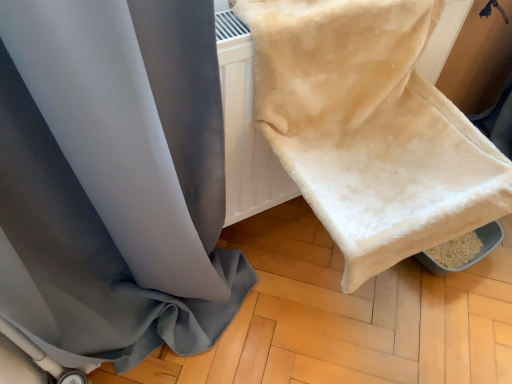
Question: Does beige plush towel at upper right have a greater height compared to satin gray curtain at upper left?

Choices:
 (A) no
 (B) yes

Answer: (A)

Question: From a real-world perspective, is beige plush towel at upper right beneath satin gray curtain at upper left?

Choices:
 (A) no
 (B) yes

Answer: (A)

Question: Is satin gray curtain at upper left at the back of beige plush towel at upper right?

Choices:
 (A) no
 (B) yes

Answer: (A)

Question: Considering the relative positions of beige plush towel at upper right and satin gray curtain at upper left in the image provided, is beige plush towel at upper right behind satin gray curtain at upper left?

Choices:
 (A) no
 (B) yes

Answer: (B)

Question: From a real-world perspective, is beige plush towel at upper right over satin gray curtain at upper left?

Choices:
 (A) no
 (B) yes

Answer: (B)

Question: Does beige plush towel at upper right come in front of satin gray curtain at upper left?

Choices:
 (A) yes
 (B) no

Answer: (B)

Question: From a real-world perspective, is satin gray curtain at upper left positioned over beige plush towel at upper right based on gravity?

Choices:
 (A) yes
 (B) no

Answer: (B)

Question: From the image's perspective, is satin gray curtain at upper left located beneath beige plush towel at upper right?

Choices:
 (A) yes
 (B) no

Answer: (A)

Question: From a real-world perspective, is satin gray curtain at upper left below beige plush towel at upper right?

Choices:
 (A) yes
 (B) no

Answer: (A)

Question: Considering the relative positions of satin gray curtain at upper left and beige plush towel at upper right in the image provided, is satin gray curtain at upper left to the left of beige plush towel at upper right from the viewer's perspective?

Choices:
 (A) yes
 (B) no

Answer: (A)

Question: Can you confirm if satin gray curtain at upper left is thinner than beige plush towel at upper right?

Choices:
 (A) no
 (B) yes

Answer: (B)

Question: Would you say satin gray curtain at upper left is a long distance from beige plush towel at upper right?

Choices:
 (A) yes
 (B) no

Answer: (B)

Question: Is beige plush towel at upper right wider or thinner than satin gray curtain at upper left?

Choices:
 (A) thin
 (B) wide

Answer: (B)